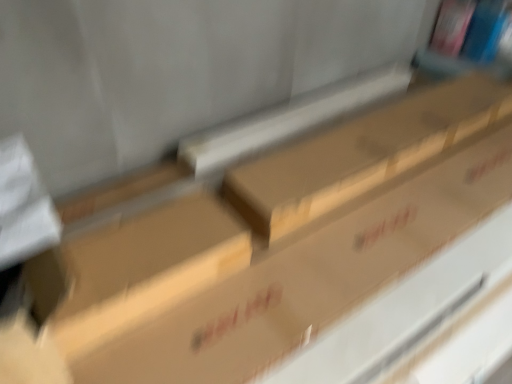
Where is `vacant space situated above brown cardboard box at center (from a real-world perspective)`? vacant space situated above brown cardboard box at center (from a real-world perspective) is located at coordinates (147, 244).